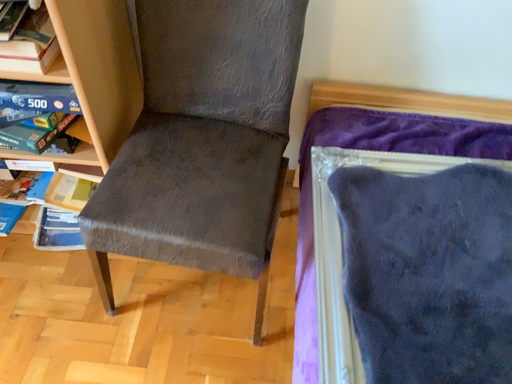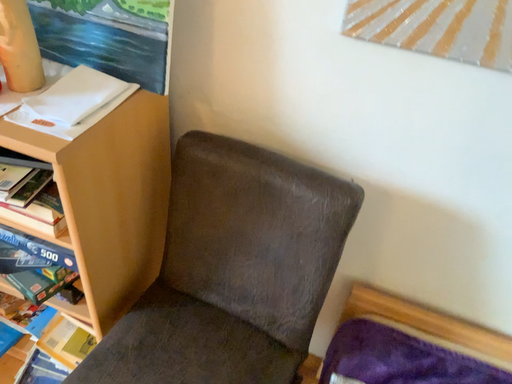
Question: How did the camera likely rotate when shooting the video?

Choices:
 (A) rotated downward
 (B) rotated upward

Answer: (B)